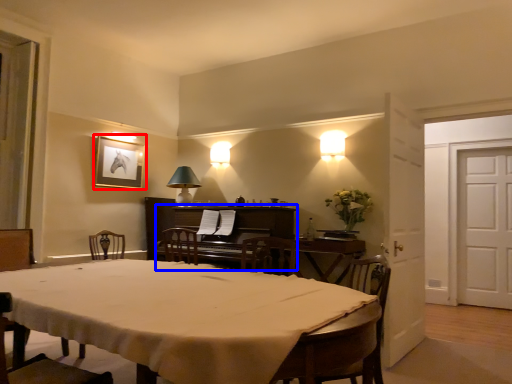
Question: Which object appears farthest to the camera in this image, picture frame (highlighted by a red box) or piano (highlighted by a blue box)?

Choices:
 (A) picture frame
 (B) piano

Answer: (A)